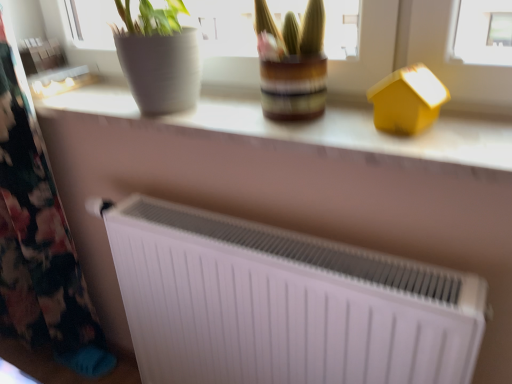
In order to face yellow matte house at upper right, should I rotate leftwards or rightwards?

Rotate right and turn 19.311 degrees.

What do you see at coordinates (305, 127) in the screenshot? Image resolution: width=512 pixels, height=384 pixels. I see `white matte radiator at center` at bounding box center [305, 127].

This screenshot has height=384, width=512. What do you see at coordinates (419, 56) in the screenshot? I see `matte white radiator at center` at bounding box center [419, 56].

Image resolution: width=512 pixels, height=384 pixels. In order to click on yellow matte house at upper right in this screenshot , I will do pyautogui.click(x=407, y=100).

From a real-world perspective, which is physically below, matte white radiator at center or white matte radiator at center?

white matte radiator at center.

Is matte white radiator at center facing towards white matte radiator at center?

No, matte white radiator at center is not facing towards white matte radiator at center.

Can you confirm if matte white radiator at center is thinner than white matte radiator at center?

Yes.

Between point (331, 88) and point (209, 130), which one is positioned behind?

Point (331, 88)

Can you confirm if matte white radiator at center is bigger than yellow matte house at upper right?

Yes.

Is matte white radiator at center oriented towards yellow matte house at upper right?

Yes, matte white radiator at center is turned towards yellow matte house at upper right.

Is matte white radiator at center located outside yellow matte house at upper right?

Indeed, matte white radiator at center is completely outside yellow matte house at upper right.

From a real-world perspective, who is located higher, matte white radiator at center or yellow matte house at upper right?

In real-world perspective, matte white radiator at center is above.

Is matte white radiator at center oriented away from white matte radiator at lower center?

No, matte white radiator at center's orientation is not away from white matte radiator at lower center.

Looking at this image, is matte white radiator at center outside of white matte radiator at lower center?

matte white radiator at center is positioned outside white matte radiator at lower center.

Which of these two, matte white radiator at center or white matte radiator at lower center, stands taller?

Standing taller between the two is white matte radiator at lower center.

Is the surface of matte white radiator at center in direct contact with white matte radiator at lower center?

No, matte white radiator at center is not in contact with white matte radiator at lower center.

Considering the relative positions of floral fabric at left and white matte radiator at center in the image provided, is floral fabric at left behind white matte radiator at center?

Yes, the depth of floral fabric at left is greater than that of white matte radiator at center.

Considering the relative positions of floral fabric at left and white matte radiator at center in the image provided, is floral fabric at left to the left or to the right of white matte radiator at center?

floral fabric at left is to the left of white matte radiator at center.

Is floral fabric at left directly adjacent to white matte radiator at center?

floral fabric at left and white matte radiator at center are clearly separated.

From the image's perspective, between floral fabric at left and white matte radiator at center, which one is located above?

white matte radiator at center, from the image's perspective.

From the image's perspective, would you say white matte radiator at lower center is positioned over yellow matte house at upper right?

No, from the image's perspective, white matte radiator at lower center is not above yellow matte house at upper right.

Looking at this image, which of these two, white matte radiator at lower center or yellow matte house at upper right, is wider?

white matte radiator at lower center is wider.

Considering the positions of objects white matte radiator at lower center and yellow matte house at upper right in the image provided, who is more to the right, white matte radiator at lower center or yellow matte house at upper right?

From the viewer's perspective, yellow matte house at upper right appears more on the right side.

Is white matte radiator at lower center positioned far away from yellow matte house at upper right?

white matte radiator at lower center is near yellow matte house at upper right, not far away.

From the image's perspective, does white matte radiator at center appear higher than matte white radiator at center?

No, from the image's perspective, white matte radiator at center is not above matte white radiator at center.

Who is shorter, white matte radiator at center or matte white radiator at center?

Standing shorter between the two is white matte radiator at center.

Which of these two, white matte radiator at center or matte white radiator at center, is thinner?

Thinner between the two is matte white radiator at center.

Can you tell me how much white matte radiator at center and matte white radiator at center differ in facing direction?

The facing directions of white matte radiator at center and matte white radiator at center are 0.0805 degrees apart.

Considering the relative sizes of yellow matte house at upper right and floral fabric at left in the image provided, is yellow matte house at upper right shorter than floral fabric at left?

Yes.

In the image, is yellow matte house at upper right on the left side or the right side of floral fabric at left?

Based on their positions, yellow matte house at upper right is located to the right of floral fabric at left.

From a real-world perspective, which is physically below, yellow matte house at upper right or floral fabric at left?

floral fabric at left.

Is yellow matte house at upper right not close to floral fabric at left?

Yes, yellow matte house at upper right and floral fabric at left are located far from each other.

Find the location of `counter top lying below the matte white radiator at center (from the image's perspective)`. counter top lying below the matte white radiator at center (from the image's perspective) is located at coordinates (305, 127).

Find the location of a particular element. The height and width of the screenshot is (384, 512). toy on the right of matte white radiator at center is located at coordinates (407, 100).

From the picture: Considering their positions, is white matte radiator at center positioned closer to matte white radiator at center than floral fabric at left?

white matte radiator at center is positioned closer to the anchor matte white radiator at center.

Estimate the real-world distances between objects in this image. Which object is closer to floral fabric at left, matte white radiator at center or yellow matte house at upper right?

The object closer to floral fabric at left is matte white radiator at center.

When comparing their distances from yellow matte house at upper right, does white matte radiator at lower center or matte white radiator at center seem further?

Based on the image, white matte radiator at lower center appears to be further to yellow matte house at upper right.

Based on their spatial positions, is matte white radiator at center or floral fabric at left closer to white matte radiator at lower center?

matte white radiator at center is positioned closer to the anchor white matte radiator at lower center.

In the scene shown: Considering their positions, is white matte radiator at lower center positioned further to white matte radiator at center than yellow matte house at upper right?

Among the two, white matte radiator at lower center is located further to white matte radiator at center.

When comparing their distances from white matte radiator at center, does floral fabric at left or matte white radiator at center seem further?

floral fabric at left is further to white matte radiator at center.

Based on their spatial positions, is matte white radiator at center or white matte radiator at lower center further from white matte radiator at center?

white matte radiator at lower center is further to white matte radiator at center.

From the picture: Considering their positions, is yellow matte house at upper right positioned closer to white matte radiator at center than matte white radiator at center?

Among the two, matte white radiator at center is located nearer to white matte radiator at center.

The height and width of the screenshot is (384, 512). In order to click on radiator located between floral fabric at left and yellow matte house at upper right in the left-right direction in this screenshot , I will do `click(282, 303)`.

Identify the location of counter top between matte white radiator at center and white matte radiator at lower center vertically. point(305,127).

Locate an element on the screen. bay window between white matte radiator at center and yellow matte house at upper right in the horizontal direction is located at coordinates (419, 56).

Identify the location of counter top located between floral fabric at left and white matte radiator at lower center in the left-right direction. (305, 127).